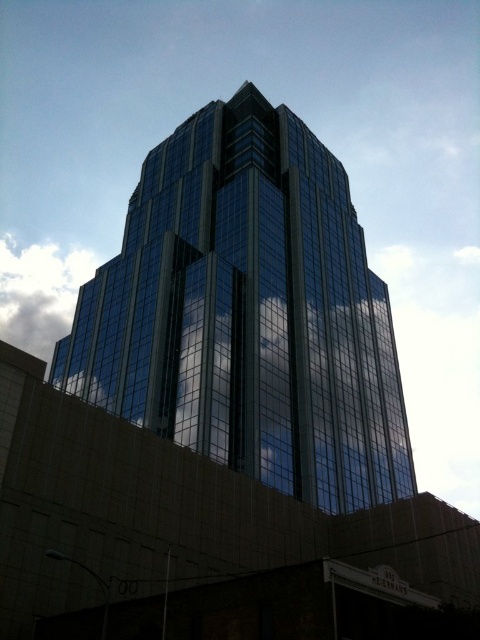
You are standing at the base of the skyscraper and notice two points marked on the building. The first point is at coordinates point (278, 115) and the second is at point (36, 278). From your vantage point, which point appears closer to you?

Point (278, 115) is in front of point (36, 278), so it appears closer to you.

You are standing in front of the skyscraper and want to take a photo of the point at coordinates point (186, 362). Your camera has a maximum focus range of 50 meters. Will the camera be able to focus on the point?

The distance between point (186, 362) and the camera is 58.64 meters, which exceeds the camera maximum focus range of 50 meters. Therefore, the camera will not be able to focus on the point.

You are an architect analyzing the skyscraper. From your observation point, which object in the image appears larger when comparing the glossy glass building at center and the white fluffy cloud at upper left?

The white fluffy cloud at upper left appears larger than the glossy glass building at center in the image.